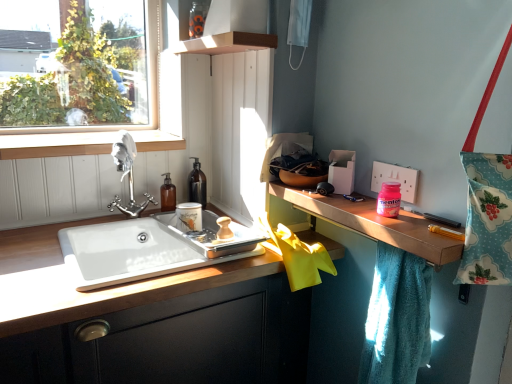
Question: Is black glass bottle at upper center in front of or behind wooden at left in the image?

Choices:
 (A) behind
 (B) front

Answer: (A)

Question: Does point (193, 196) appear closer or farther from the camera than point (39, 137)?

Choices:
 (A) closer
 (B) farther

Answer: (B)

Question: Which object is positioned farthest from the teal soft towel at right?

Choices:
 (A) brown glass pump bottle at upper left, which is counted as the second toiletry, starting from the front
 (B) black glass bottle at upper center
 (C) wooden at left
 (D) wooden at right
 (E) floral fabric tote bag at right

Answer: (C)

Question: Which of these objects is positioned closest to the black glass bottle at upper center?

Choices:
 (A) pink glossy mentos at upper right, placed as the first toiletry when sorted from right to left
 (B) teal soft towel at right
 (C) wooden cabinet at lower left
 (D) wooden at left
 (E) floral fabric tote bag at right

Answer: (D)